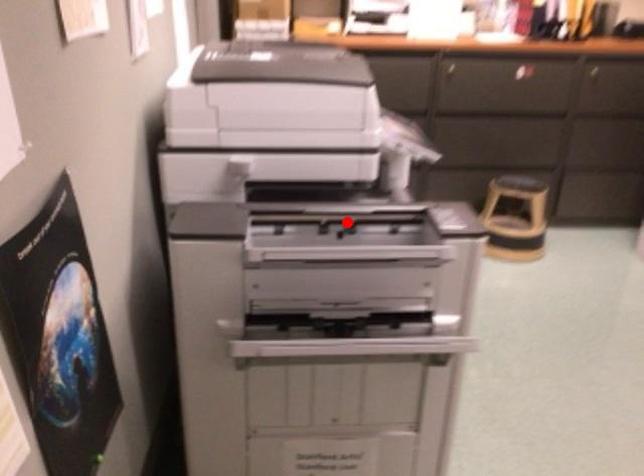
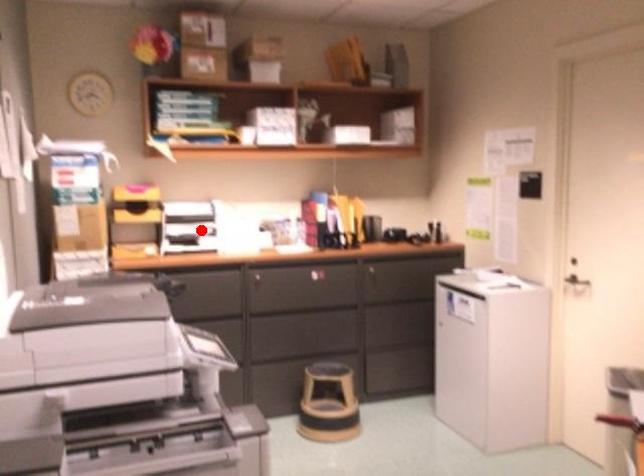
I am providing you with two images of the same scene from different viewpoints. A red point is marked on the first image and another point is marked on the second image. Is the marked point in image1 the same physical position as the marked point in image2?

No